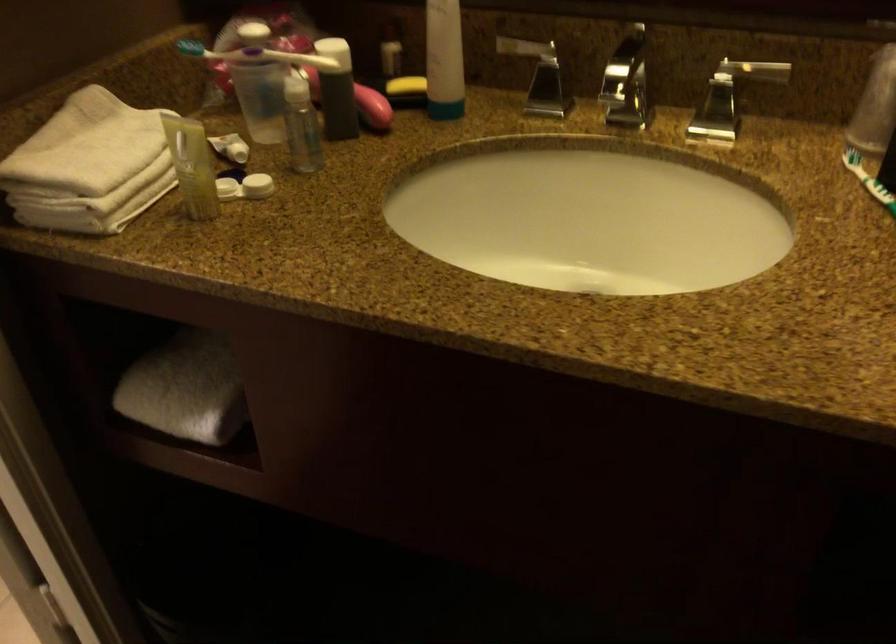
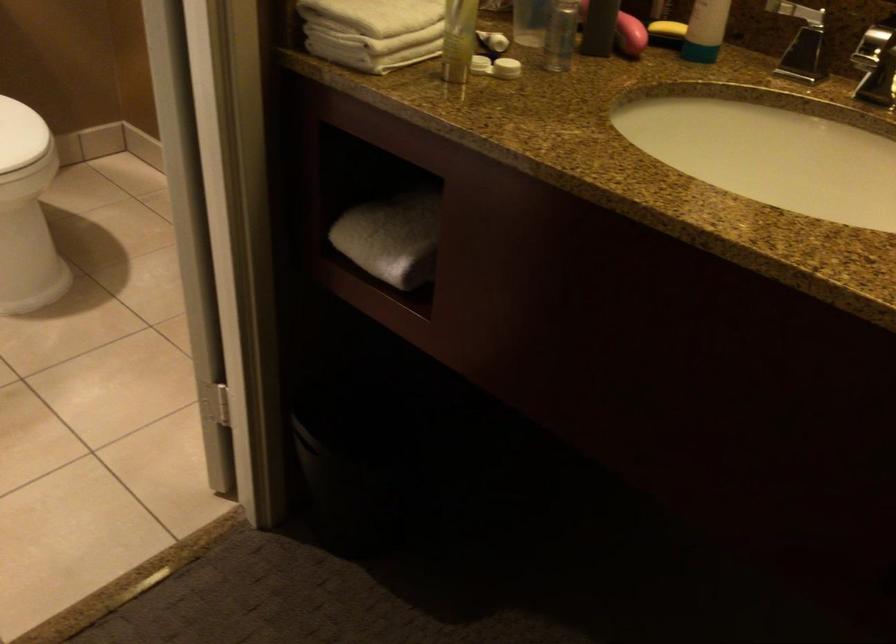
Find the pixel in the second image that matches point (226, 190) in the first image.

(479, 64)